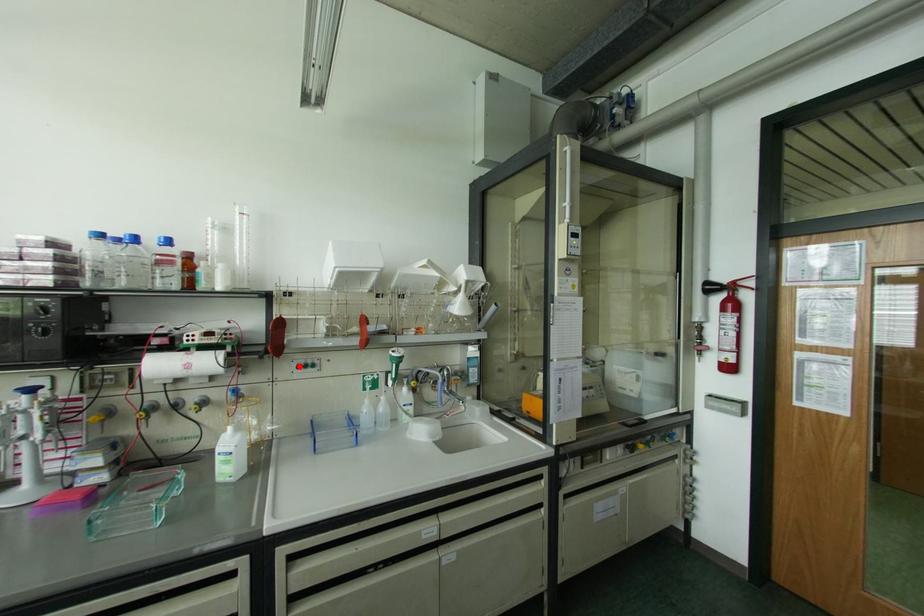
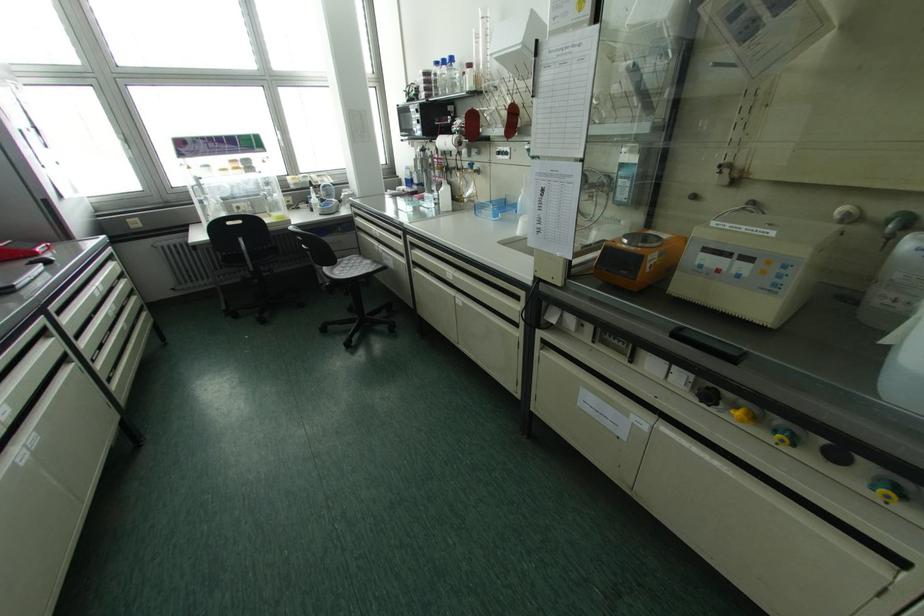
Question: I am providing you with two images of the same scene from different viewpoints. Image1 has a red point marked. In image2, the corresponding 3D location appears at what relative position? Reply with the corresponding letter.

Choices:
 (A) Closer
 (B) Farther

Answer: (A)